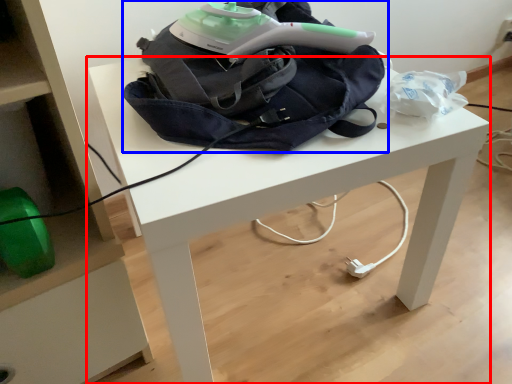
Question: Which object is closer to the camera taking this photo, table (highlighted by a red box) or bag (highlighted by a blue box)?

Choices:
 (A) table
 (B) bag

Answer: (A)